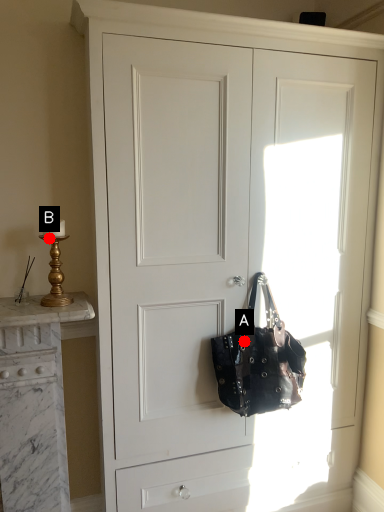
Question: Two points are circled on the image, labeled by A and B beside each circle. Which point is farther from the camera taking this photo?

Choices:
 (A) A is further
 (B) B is further

Answer: (A)